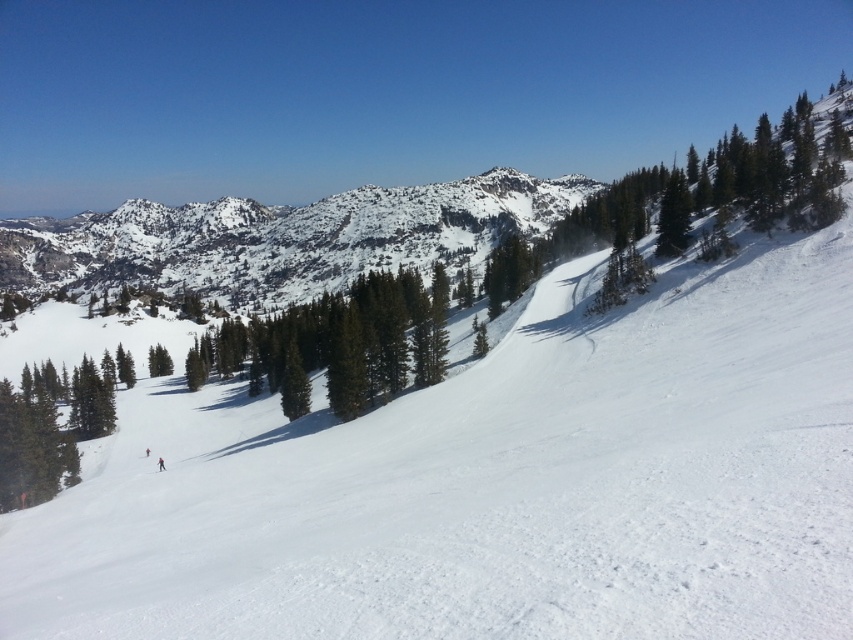
Is green matte tree at center to the left of red matte ski at lower left from the viewer's perspective?

No, green matte tree at center is not to the left of red matte ski at lower left.

Can you confirm if green matte tree at center is thinner than red matte ski at lower left?

In fact, green matte tree at center might be wider than red matte ski at lower left.

Between point (287, 403) and point (160, 458), which one is positioned in front?

Point (160, 458)

Where is `green matte tree at center`? green matte tree at center is located at coordinates (294, 385).

Is point (410, 205) positioned in front of point (160, 467)?

No, (410, 205) is further to viewer.

Is snowy rocky mountain at center positioned in front of red matte ski at lower left?

No, snowy rocky mountain at center is further to the viewer.

Between point (218, 250) and point (160, 465), which one is positioned in front?

Point (160, 465)

Identify the location of snowy rocky mountain at center. tap(283, 237).

Is point (189, 224) in front of point (292, 378)?

That is False.

Who is lower down, snowy rocky mountain at center or green matte tree at center?

Positioned lower is green matte tree at center.

At what (x,y) coordinates should I click in order to perform the action: click on snowy rocky mountain at center. Please return your answer as a coordinate pair (x, y). Looking at the image, I should click on (283, 237).